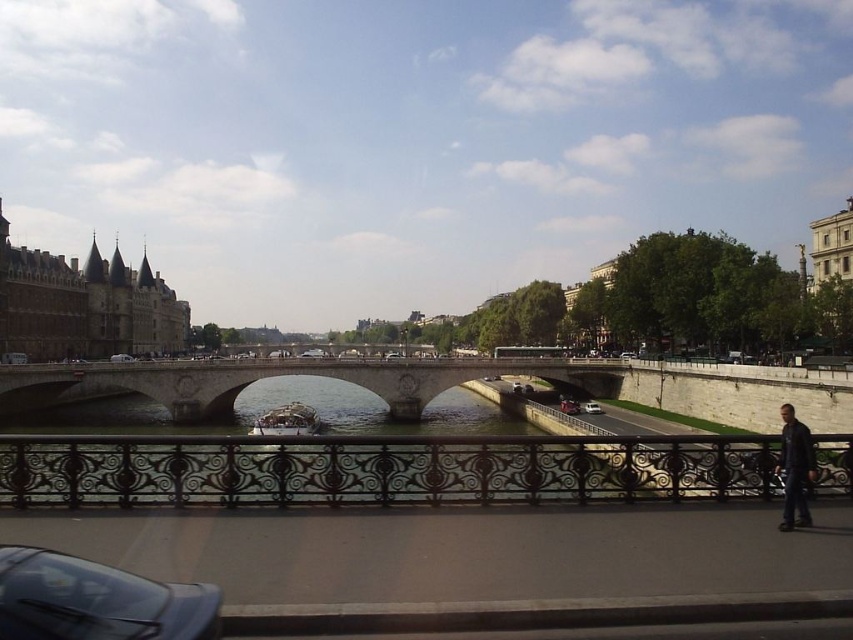
Question: Can you confirm if shiny black car at lower left is smaller than metallic silver boat at center?

Choices:
 (A) no
 (B) yes

Answer: (B)

Question: Does shiny black car at lower left have a lesser width compared to dark blue leather jacket at lower right?

Choices:
 (A) yes
 (B) no

Answer: (A)

Question: Which point is farther to the camera?

Choices:
 (A) metallic silver boat at center
 (B) black wrought iron railing at center

Answer: (A)

Question: Can you confirm if shiny black car at lower left is positioned to the right of white matte van at center?

Choices:
 (A) yes
 (B) no

Answer: (A)

Question: Which point is closer to the camera?

Choices:
 (A) [x=3, y=593]
 (B) [x=595, y=412]
 (C) [x=323, y=349]

Answer: (A)

Question: Which point is closer to the camera?

Choices:
 (A) (592, 413)
 (B) (602, 484)
 (C) (317, 349)
 (D) (793, 522)

Answer: (D)